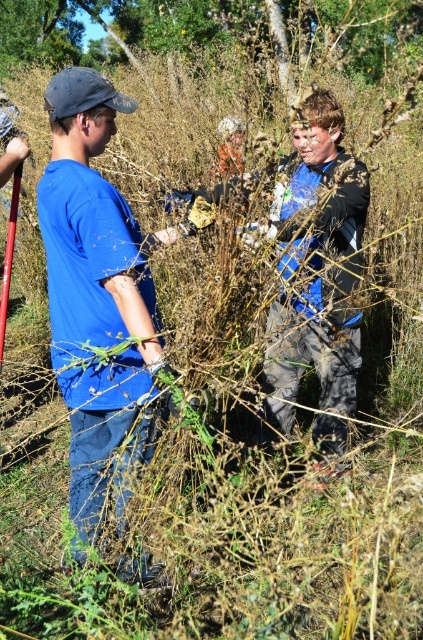
I want to click on blue cotton shirt at left, so click(93, 284).

Is blue cotton shirt at left above green leafy tree at upper center?

No.

What do you see at coordinates (93, 284) in the screenshot? I see `blue cotton shirt at left` at bounding box center [93, 284].

I want to click on blue cotton shirt at left, so click(93, 284).